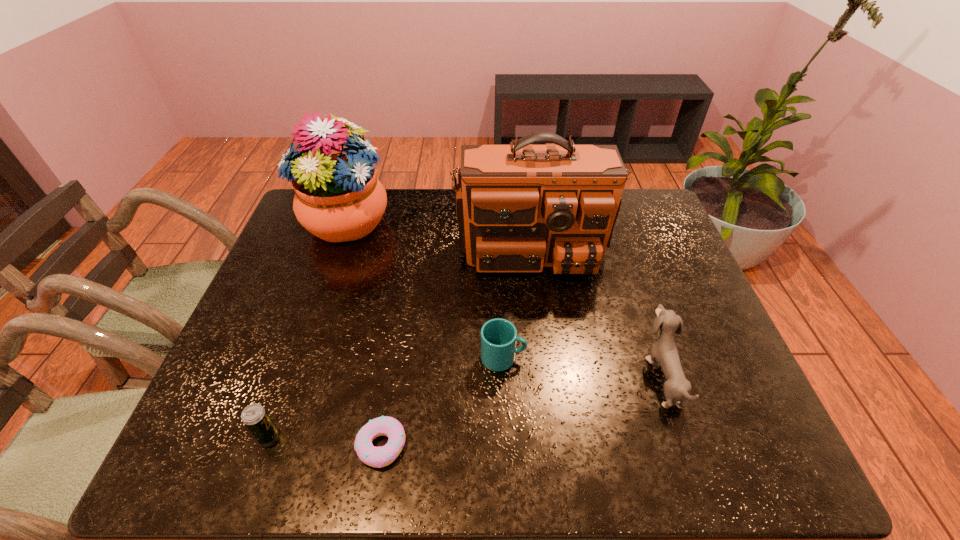
At what (x,y) coordinates should I click in order to perform the action: click on beer can that is at the left edge. Please return your answer as a coordinate pair (x, y). Looking at the image, I should click on (256, 419).

Find the location of a particular element. The height and width of the screenshot is (540, 960). object that is at the right edge is located at coordinates (664, 350).

The height and width of the screenshot is (540, 960). In order to click on object present at the far left corner in this screenshot , I will do `click(338, 198)`.

The height and width of the screenshot is (540, 960). I want to click on object situated at the near left corner, so click(x=256, y=419).

Locate an element on the screen. vacant space at the far edge of the desktop is located at coordinates (420, 202).

This screenshot has width=960, height=540. Find the location of `vacant area at the near edge of the desktop`. vacant area at the near edge of the desktop is located at coordinates (274, 461).

Where is `blank space at the right edge`? This screenshot has height=540, width=960. blank space at the right edge is located at coordinates (754, 421).

Identify the location of vacant space at the far right corner of the desktop. The width and height of the screenshot is (960, 540). coord(627,205).

At what (x,y) coordinates should I click in order to perform the action: click on empty space that is in between the satchel and the cup. Please return your answer as a coordinate pair (x, y). The height and width of the screenshot is (540, 960). Looking at the image, I should click on (516, 294).

You are a GUI agent. You are given a task and a screenshot of the screen. Output one action in this format:
    pyautogui.click(x=<x>, y=<y>)
    Task: Click on the free space between the third tallest object and the beer can
    
    Given the screenshot: What is the action you would take?
    pyautogui.click(x=465, y=406)